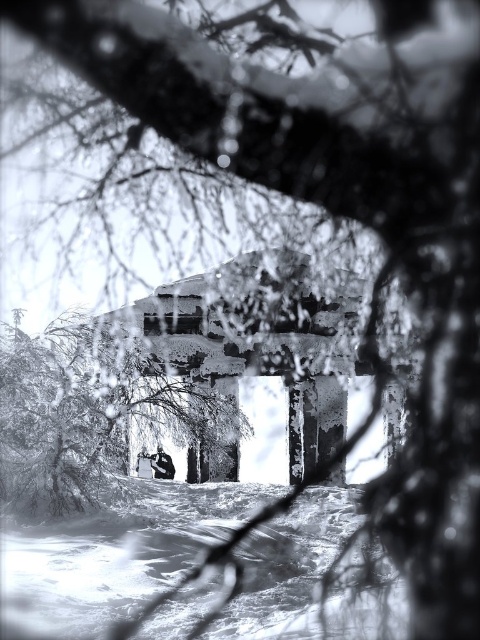
Question: Which point is farther from the camera taking this photo?

Choices:
 (A) (396, 612)
 (B) (157, 461)
 (C) (24, 456)

Answer: (B)

Question: Is white powdery snow at lower center positioned in front of snow-covered branches at center?

Choices:
 (A) no
 (B) yes

Answer: (B)

Question: Considering the real-world distances, which object is closest to the white powdery snow at lower center?

Choices:
 (A) snow-covered branches at center
 (B) dark gray fabric jacket at center

Answer: (A)

Question: In this image, where is white powdery snow at lower center located relative to dark gray fabric jacket at center?

Choices:
 (A) below
 (B) above

Answer: (B)

Question: Can you confirm if snow-covered branches at center is positioned above dark gray fabric jacket at center?

Choices:
 (A) yes
 (B) no

Answer: (A)

Question: Which object appears closest to the camera in this image?

Choices:
 (A) snow-covered branches at center
 (B) white powdery snow at lower center

Answer: (B)